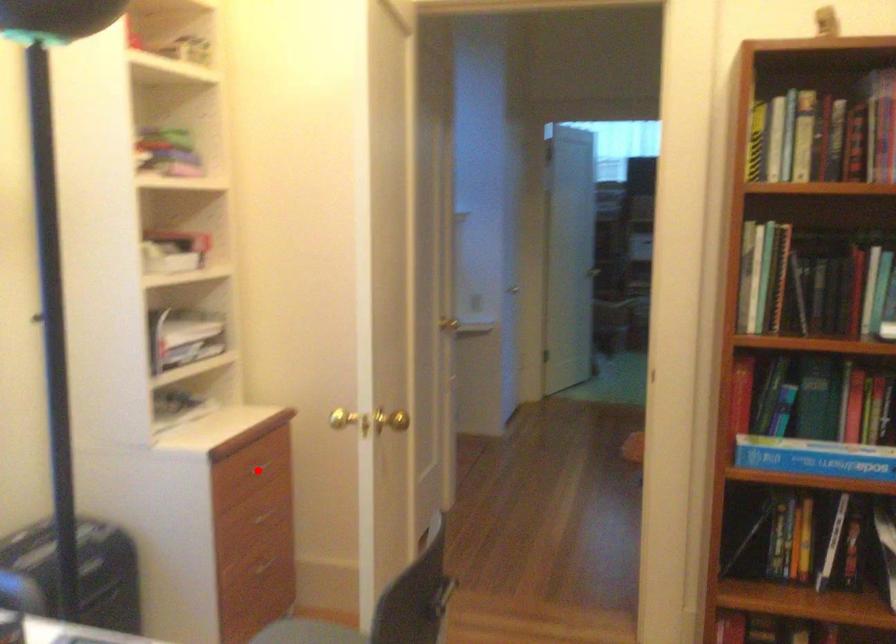
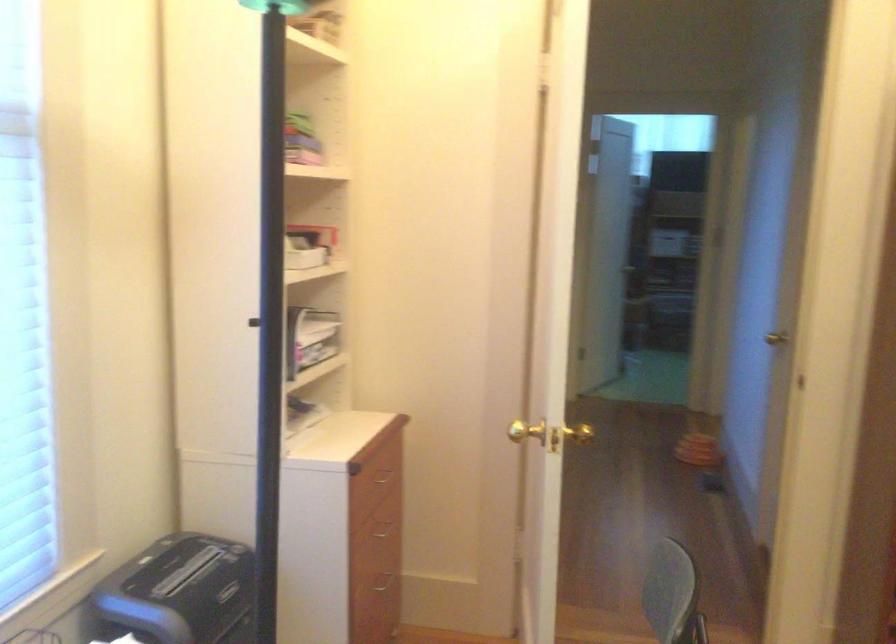
Where in the second image is the point corresponding to the highlighted location from the first image?

(383, 478)